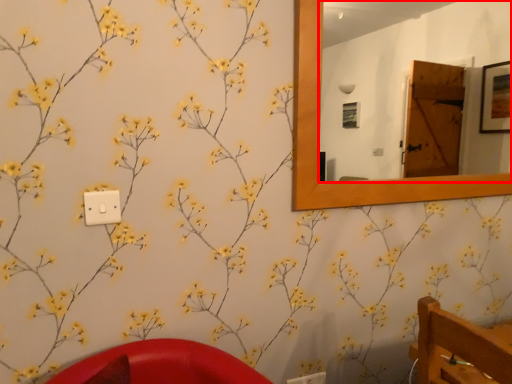
Question: From the image's perspective, where is mirror (annotated by the red box) located in relation to light switch in the image?

Choices:
 (A) above
 (B) below

Answer: (A)